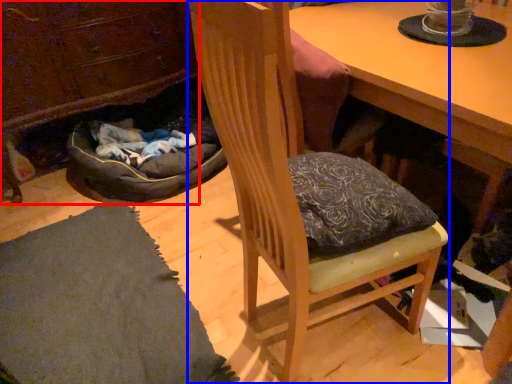
Question: Which of the following is the closest to the observer, cabinetry (highlighted by a red box) or chair (highlighted by a blue box)?

Choices:
 (A) cabinetry
 (B) chair

Answer: (B)